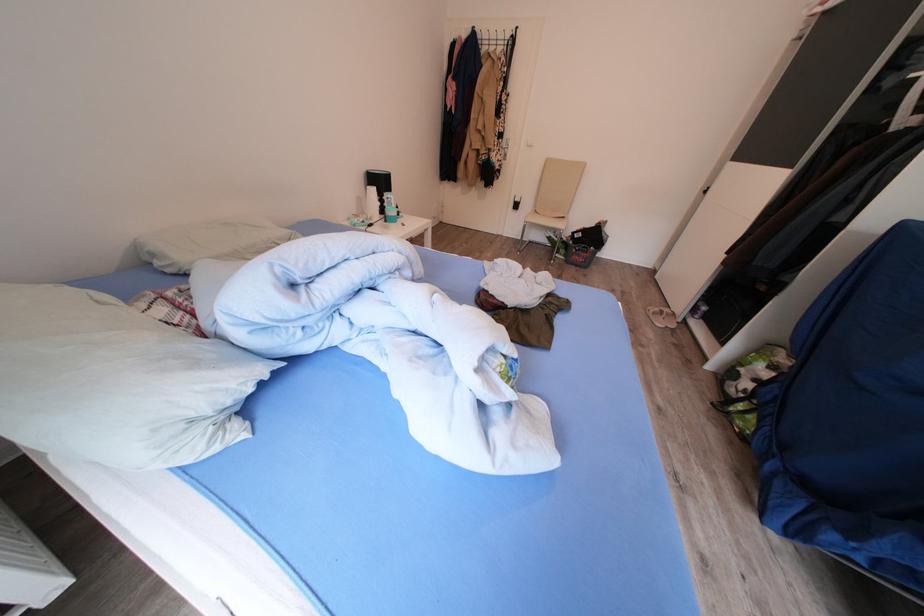
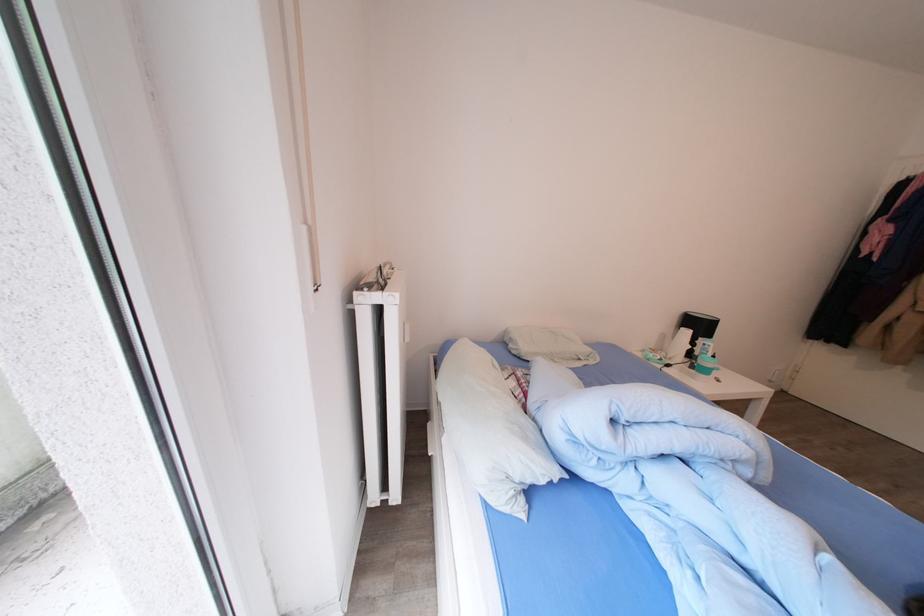
Find the pixel in the second image that matches point 388,188 in the first image.

(708, 331)